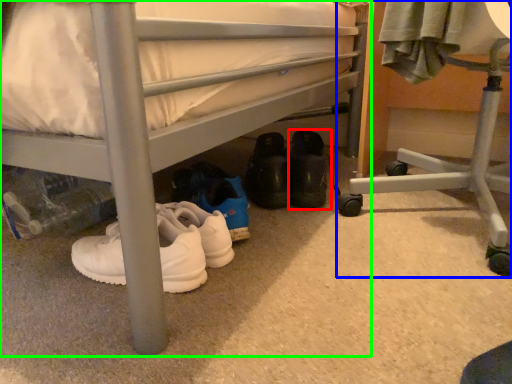
Question: Based on their relative distances, which object is nearer to footwear (highlighted by a red box)? Choose from furniture (highlighted by a blue box) and bed (highlighted by a green box).

Choices:
 (A) furniture
 (B) bed

Answer: (A)